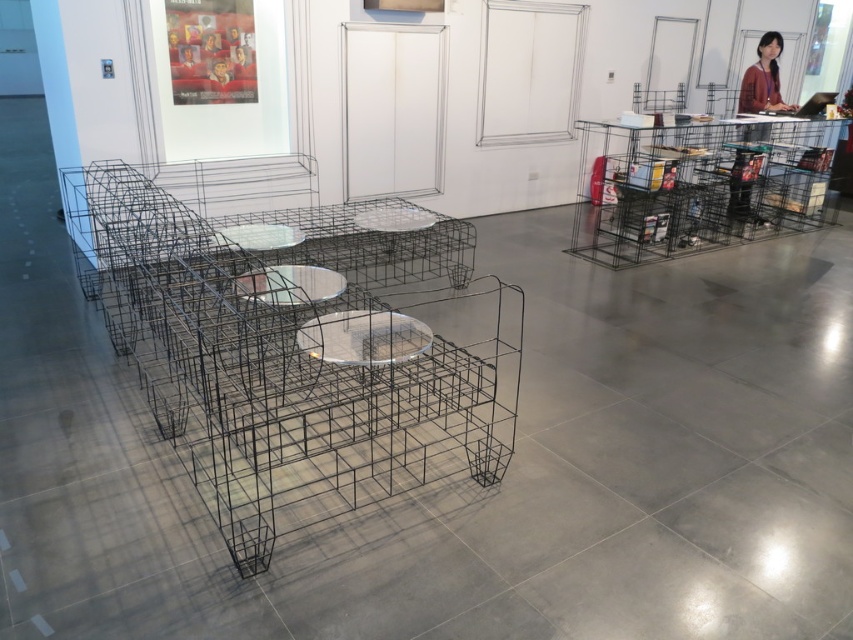
Does transparent glass table at center appear over matte black jacket at upper right?

Actually, transparent glass table at center is below matte black jacket at upper right.

Based on the photo, how distant is transparent glass table at center from matte black jacket at upper right?

They are 18.66 feet apart.

The height and width of the screenshot is (640, 853). I want to click on transparent glass table at center, so click(363, 337).

The image size is (853, 640). What are the coordinates of `transparent glass table at center` in the screenshot? It's located at (363, 337).

Describe the element at coordinates (763, 77) in the screenshot. I see `matte black jacket at upper right` at that location.

Who is lower down, matte black jacket at upper right or clear glass table at center?

clear glass table at center is lower down.

Who is more distant from viewer, (749, 67) or (306, 275)?

The point (749, 67) is more distant.

I want to click on matte black jacket at upper right, so click(763, 77).

Can you confirm if transparent glass table at center is wider than clear glass table at center?

Correct, the width of transparent glass table at center exceeds that of clear glass table at center.

Is point (358, 364) more distant than point (235, 289)?

That is False.

Where is `transparent glass table at center`? This screenshot has width=853, height=640. transparent glass table at center is located at coordinates (363, 337).